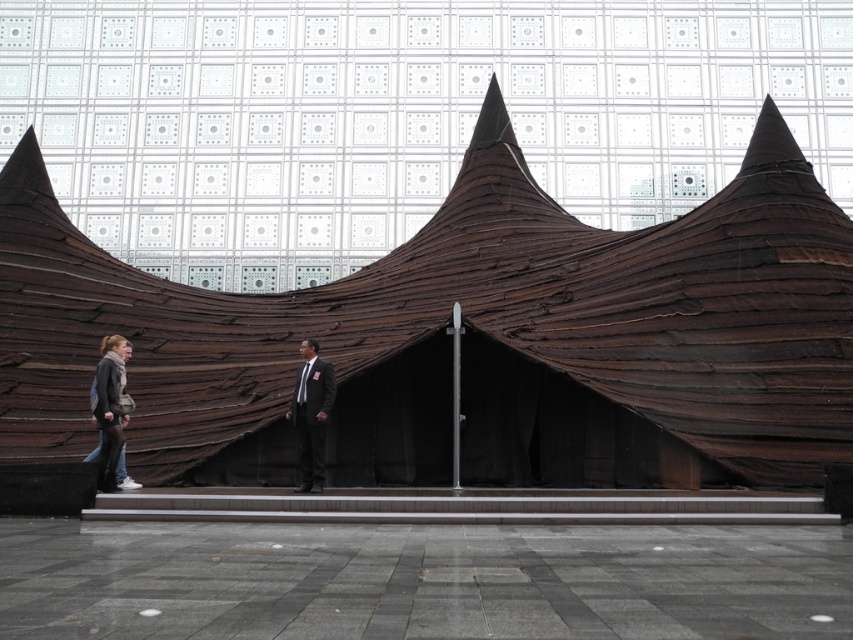
Question: Estimate the real-world distances between objects in this image. Which object is closer to the matte gray jacket at lower left?

Choices:
 (A) brown wood sculpture at center
 (B) matte black suit at center

Answer: (B)

Question: Is brown wood sculpture at center positioned behind matte gray jacket at lower left?

Choices:
 (A) yes
 (B) no

Answer: (A)

Question: Does matte black suit at center appear under matte gray jacket at lower left?

Choices:
 (A) no
 (B) yes

Answer: (A)

Question: Among these objects, which one is nearest to the camera?

Choices:
 (A) brown wood sculpture at center
 (B) matte gray jacket at lower left

Answer: (B)

Question: Among these objects, which one is farthest from the camera?

Choices:
 (A) matte gray jacket at lower left
 (B) matte black suit at center
 (C) brown wood sculpture at center

Answer: (B)

Question: Does brown wood sculpture at center come in front of matte gray jacket at lower left?

Choices:
 (A) yes
 (B) no

Answer: (B)